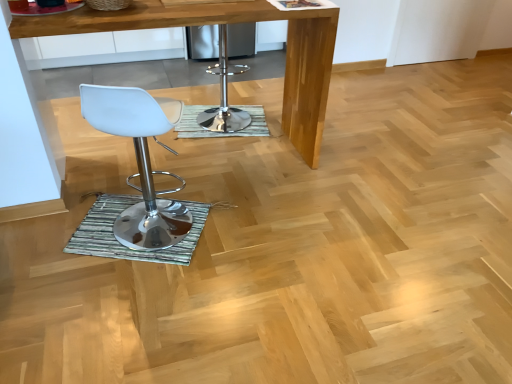
Question: Can you confirm if white plastic stool at left is positioned to the right of green textured mat at center, the 2th mat when ordered from back to front?

Choices:
 (A) yes
 (B) no

Answer: (A)

Question: From a real-world perspective, is white plastic stool at left on green textured mat at center, which is counted as the first mat, starting from the bottom?

Choices:
 (A) no
 (B) yes

Answer: (B)

Question: From the image's perspective, does white plastic stool at left appear lower than green textured mat at center, the 2th mat when ordered from back to front?

Choices:
 (A) yes
 (B) no

Answer: (B)

Question: Is the position of white plastic stool at left more distant than that of green textured mat at center, the 2th mat positioned from the top?

Choices:
 (A) yes
 (B) no

Answer: (B)

Question: Does white plastic stool at left have a lesser width compared to green textured mat at center, which is counted as the first mat, starting from the bottom?

Choices:
 (A) yes
 (B) no

Answer: (A)

Question: From the image's perspective, is white plastic stool at left above green textured mat at center, the 2th mat when ordered from back to front?

Choices:
 (A) yes
 (B) no

Answer: (A)

Question: Would you say wooden table at center is outside white plastic stool at left?

Choices:
 (A) yes
 (B) no

Answer: (A)

Question: Is wooden table at center far from white plastic stool at left?

Choices:
 (A) no
 (B) yes

Answer: (A)

Question: Does wooden table at center have a lesser width compared to white plastic stool at left?

Choices:
 (A) yes
 (B) no

Answer: (B)

Question: Does wooden table at center appear on the right side of white plastic stool at left?

Choices:
 (A) yes
 (B) no

Answer: (A)

Question: From a real-world perspective, is wooden table at center positioned under white plastic stool at left based on gravity?

Choices:
 (A) yes
 (B) no

Answer: (B)

Question: Is wooden table at center positioned behind white plastic stool at left?

Choices:
 (A) yes
 (B) no

Answer: (A)

Question: Considering the relative sizes of wooden table at center and green textured mat at center, marked as the first mat in a back-to-front arrangement, in the image provided, is wooden table at center bigger than green textured mat at center, marked as the first mat in a back-to-front arrangement,?

Choices:
 (A) yes
 (B) no

Answer: (A)